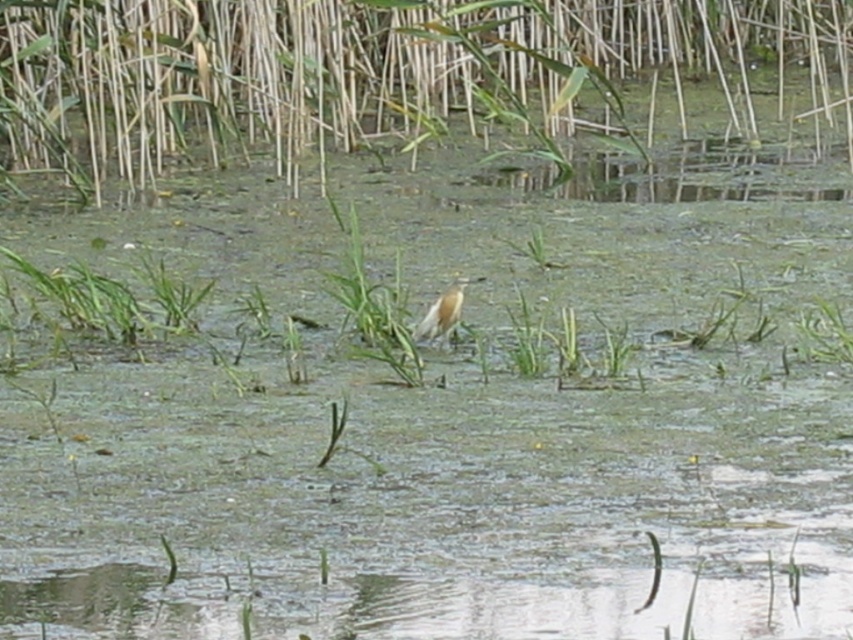
You are a photographer trying to capture a shot of the white matte bird at center and the green grass at upper center. Which object is located to the left of the other?

The green grass at upper center is positioned on the left side of the white matte bird at center.